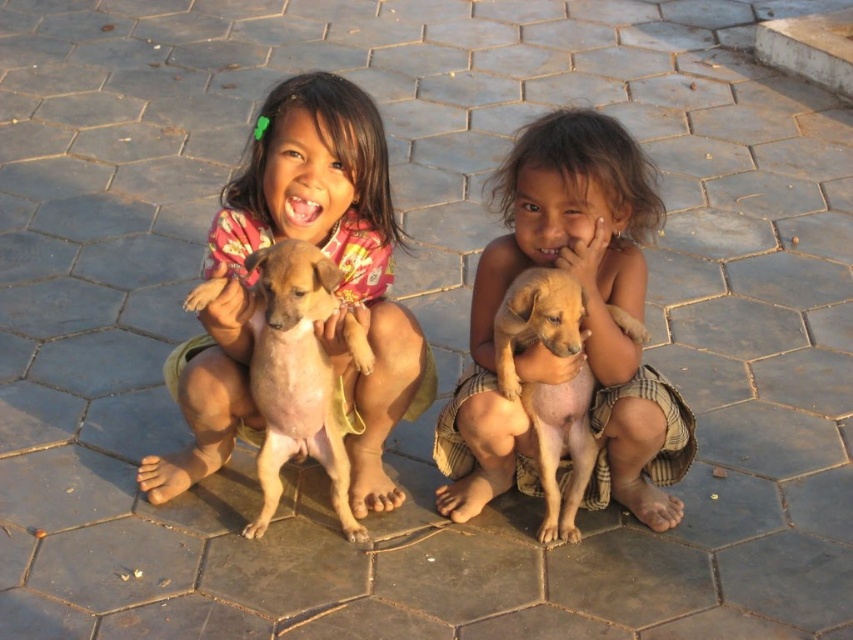
Question: Is light brown fur puppy at center to the left of light brown fur at center from the viewer's perspective?

Choices:
 (A) yes
 (B) no

Answer: (B)

Question: Can you confirm if light brown fur puppy at center is bigger than light brown fur at center?

Choices:
 (A) yes
 (B) no

Answer: (A)

Question: Based on their relative distances, which object is farther from the light brown fur at center?

Choices:
 (A) light brown fur puppy at center
 (B) matte pink shirt at center

Answer: (B)

Question: Which point appears closest to the camera in this image?

Choices:
 (A) (601, 172)
 (B) (312, 388)
 (C) (554, 497)

Answer: (A)

Question: Does brown furry dog at center lie in front of light brown fur at center?

Choices:
 (A) no
 (B) yes

Answer: (B)

Question: Which of the following is the farthest from the observer?

Choices:
 (A) 606,131
 (B) 553,433

Answer: (B)